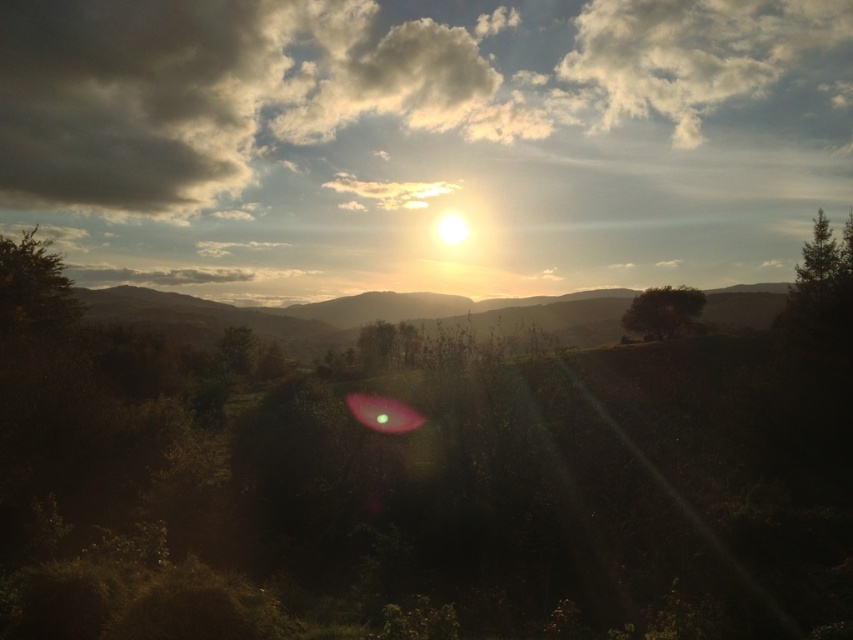
Does point (850, 305) lie behind point (810, 269)?

That is False.

Is point (827, 296) closer to camera compared to point (833, 259)?

Yes, point (827, 296) is closer to viewer.

Between point (817, 212) and point (804, 275), which one is positioned in front?

Positioned in front is point (804, 275).

Identify the location of green matte tree at right. (822, 284).

Does green leafy tree at center have a greater height compared to green matte tree at upper right?

No.

Locate an element on the screen. The image size is (853, 640). green leafy tree at center is located at coordinates (662, 310).

Image resolution: width=853 pixels, height=640 pixels. In order to click on green leafy tree at left in this screenshot , I will do `click(33, 285)`.

Who is positioned more to the right, green leafy tree at left or green leafy tree at center?

green leafy tree at center is more to the right.

I want to click on green leafy tree at left, so click(x=33, y=285).